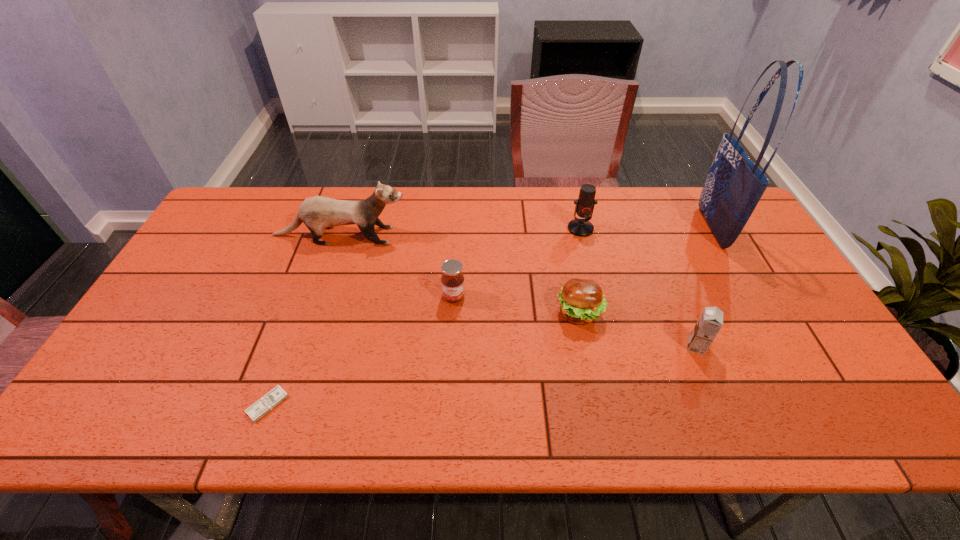
Identify the location of free space between the shortest object and the microphone. The height and width of the screenshot is (540, 960). (424, 316).

Image resolution: width=960 pixels, height=540 pixels. Find the location of `empty space between the shopping bag and the second nearest object`. empty space between the shopping bag and the second nearest object is located at coordinates (704, 287).

I want to click on vacant area that lies between the money and the second object from right to left, so click(482, 375).

Identify the location of vacant space in between the sixth farthest object and the microphone. (638, 287).

Where is `free space between the tallest object and the second nearest object`? This screenshot has width=960, height=540. free space between the tallest object and the second nearest object is located at coordinates (704, 287).

Where is `free area in between the shortest object and the sixth farthest object`? Image resolution: width=960 pixels, height=540 pixels. free area in between the shortest object and the sixth farthest object is located at coordinates (482, 375).

In order to click on vacant space that's between the microphone and the jam in this screenshot , I will do `click(517, 262)`.

The width and height of the screenshot is (960, 540). What are the coordinates of `free space between the sixth farthest object and the shopping bag` in the screenshot? It's located at (704, 287).

Select which object is the fifth closest to the second tallest object. Please provide its 2D coordinates. Your answer should be formatted as a tuple, i.e. [(x, y)], where the tuple contains the x and y coordinates of a point satisfying the conditions above.

[(708, 325)]

I want to click on the sixth closest object to the tallest object, so click(x=265, y=404).